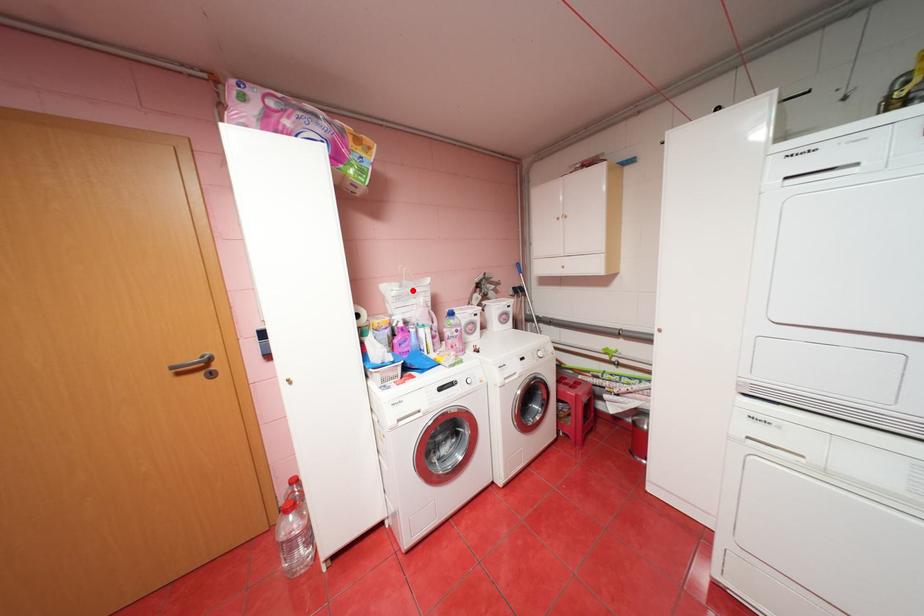
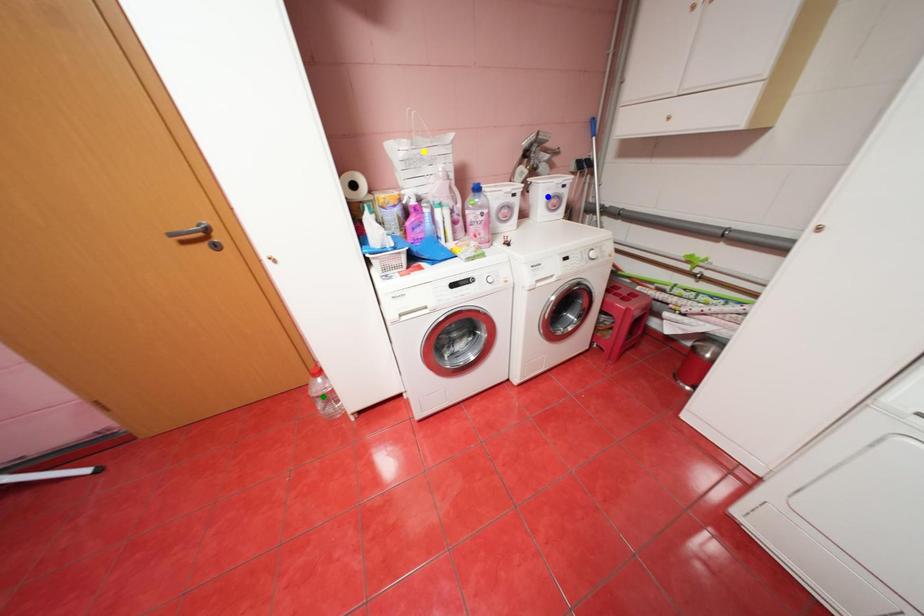
Question: I am providing you with two images of the same scene from different viewpoints. A red point is marked on the first image. You are given multiple points on the second image. Which mark in image 2 goes with the point in image 1?

Choices:
 (A) yellow point
 (B) green point
 (C) blue point

Answer: (A)